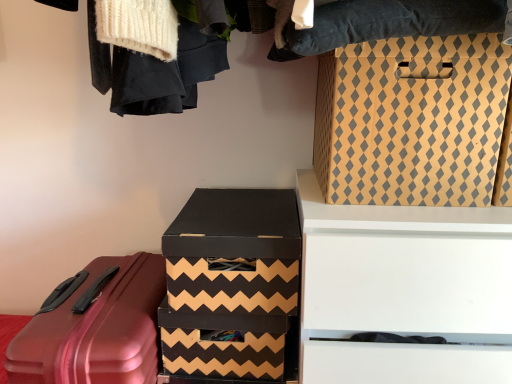
Question: Is white matte drawer at upper right situated inside matte cardboard box at upper right, arranged as the 1th box when viewed from the top, or outside?

Choices:
 (A) outside
 (B) inside

Answer: (A)

Question: In terms of width, does white matte drawer at upper right look wider or thinner when compared to matte cardboard box at upper right, the 3th box in the bottom-to-top sequence?

Choices:
 (A) wide
 (B) thin

Answer: (A)

Question: Estimate the real-world distances between objects in this image. Which object is closer to the black cardboard box at center, marked as the 2th box in a bottom-to-top arrangement?

Choices:
 (A) matte cardboard box at upper right, the 3th box in the bottom-to-top sequence
 (B) white matte drawer at upper right
 (C) shiny red suitcase at lower left
 (D) brown zigzag-patterned box at center, placed as the 3th box when sorted from top to bottom

Answer: (D)

Question: Which object is positioned farthest from the black cardboard box at center, the second box from the top?

Choices:
 (A) matte cardboard box at upper right, arranged as the 1th box when viewed from the top
 (B) brown zigzag-patterned box at center, placed as the 3th box when sorted from top to bottom
 (C) shiny red suitcase at lower left
 (D) white matte drawer at upper right

Answer: (A)